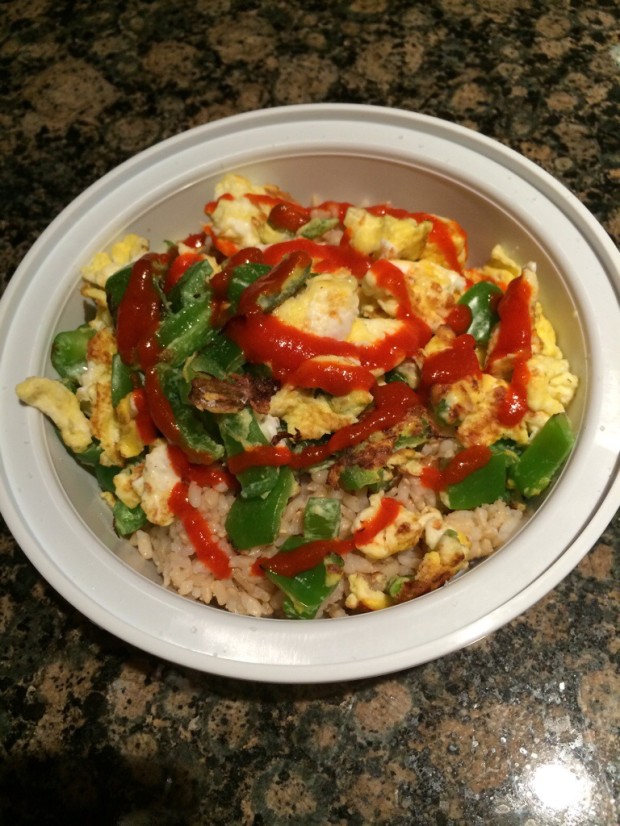
This screenshot has width=620, height=826. What are the coordinates of `outer ring of bowl` in the screenshot? It's located at (105, 622).